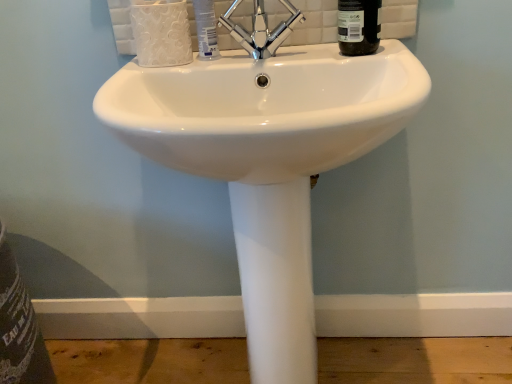
Question: Is white ceramic sink at center bigger than black glass bottle at upper right?

Choices:
 (A) no
 (B) yes

Answer: (B)

Question: Is the depth of white ceramic sink at center greater than that of black glass bottle at upper right?

Choices:
 (A) yes
 (B) no

Answer: (B)

Question: Can you confirm if white ceramic sink at center is positioned to the left of black glass bottle at upper right?

Choices:
 (A) yes
 (B) no

Answer: (A)

Question: Could you tell me if white ceramic sink at center is facing black glass bottle at upper right?

Choices:
 (A) no
 (B) yes

Answer: (A)

Question: Is white ceramic sink at center smaller than black glass bottle at upper right?

Choices:
 (A) no
 (B) yes

Answer: (A)

Question: In the image, is black glass bottle at upper right positioned in front of or behind chrome metallic faucet at center?

Choices:
 (A) front
 (B) behind

Answer: (B)

Question: In terms of size, does black glass bottle at upper right appear bigger or smaller than chrome metallic faucet at center?

Choices:
 (A) small
 (B) big

Answer: (A)

Question: Is point (370, 38) closer or farther from the camera than point (278, 41)?

Choices:
 (A) closer
 (B) farther

Answer: (A)

Question: From a real-world perspective, is black glass bottle at upper right physically located above or below chrome metallic faucet at center?

Choices:
 (A) below
 (B) above

Answer: (A)

Question: Considering the positions of black glass bottle at upper right and white plastic tube at center in the image, is black glass bottle at upper right taller or shorter than white plastic tube at center?

Choices:
 (A) short
 (B) tall

Answer: (B)

Question: From the image's perspective, is black glass bottle at upper right positioned above or below white plastic tube at center?

Choices:
 (A) below
 (B) above

Answer: (B)

Question: Looking at their shapes, would you say black glass bottle at upper right is wider or thinner than white plastic tube at center?

Choices:
 (A) thin
 (B) wide

Answer: (B)

Question: From a real-world perspective, is black glass bottle at upper right physically located above or below white plastic tube at center?

Choices:
 (A) below
 (B) above

Answer: (B)

Question: In the image, is chrome metallic faucet at center on the left side or the right side of white plastic tube at center?

Choices:
 (A) right
 (B) left

Answer: (A)

Question: From the image's perspective, is chrome metallic faucet at center located above or below white plastic tube at center?

Choices:
 (A) above
 (B) below

Answer: (B)